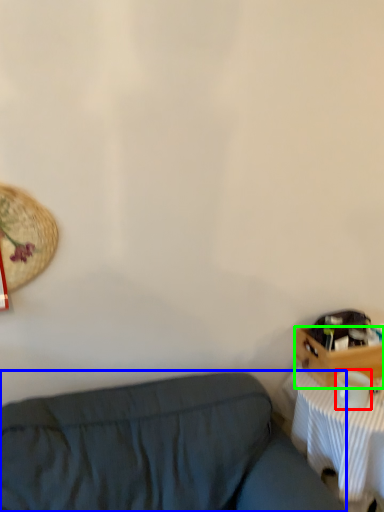
Question: Which object is positioned farthest from coffee cup (highlighted by a red box)? Select from studio couch (highlighted by a blue box) and drawer (highlighted by a green box).

Choices:
 (A) studio couch
 (B) drawer

Answer: (A)